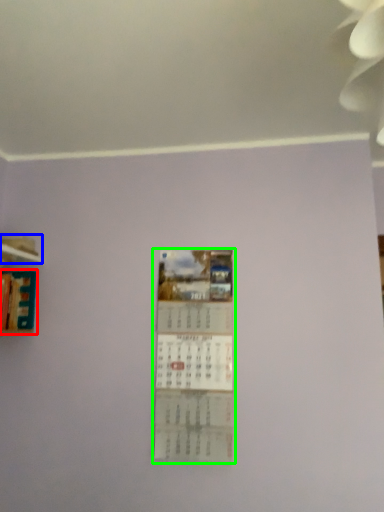
Question: Considering the real-world distances, which object is farthest from book (highlighted by a red box)? shelf (highlighted by a blue box) or poster (highlighted by a green box)?

Choices:
 (A) shelf
 (B) poster

Answer: (B)